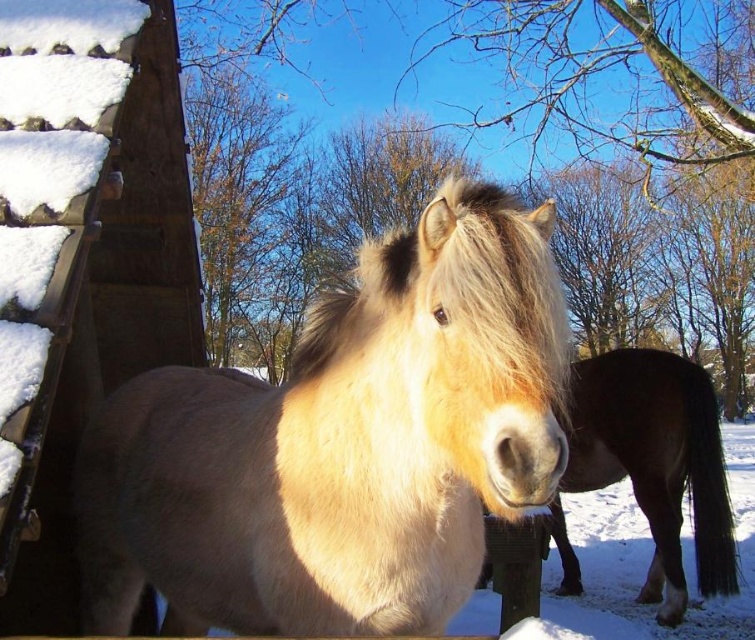
You are standing at the origin point of this winter scene. Where is the light brown fur horse at center located in terms of coordinates?

The light brown fur horse at center is located at coordinates point (341, 444).

You are standing in the winter scene with two horses. You see a point at position (128, 506) and another point at (479, 584). Which point is nearer to you?

The point at (128, 506) is closer to the viewer than the point at (479, 584).